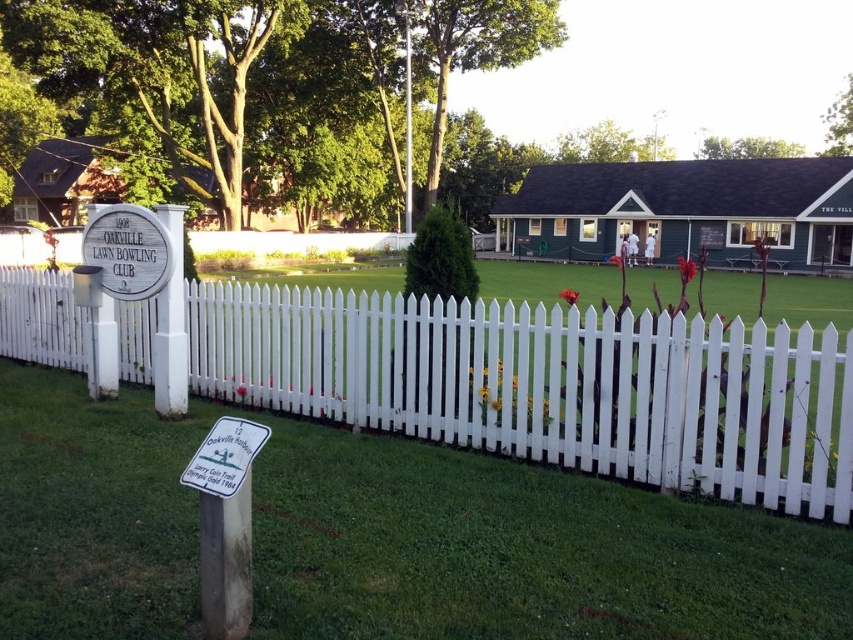
Question: Where is white picket fence at center located in relation to green mossy pole at center in the image?

Choices:
 (A) right
 (B) left

Answer: (A)

Question: Does green grass at center have a greater width compared to white plastic sign at lower center?

Choices:
 (A) yes
 (B) no

Answer: (A)

Question: Which object appears farthest from the camera in this image?

Choices:
 (A) green grass at center
 (B) white picket fence at center
 (C) silver metallic sign at center-left
 (D) green mossy pole at center

Answer: (D)

Question: Among these objects, which one is nearest to the camera?

Choices:
 (A) green grass at center
 (B) white plastic sign at lower center
 (C) silver metallic sign at center-left

Answer: (B)

Question: Which is nearer to the white plastic sign at lower center?

Choices:
 (A) green grass at center
 (B) white picket fence at center
 (C) green mossy pole at center
 (D) silver metallic sign at center-left

Answer: (A)

Question: Can you confirm if white plastic sign at lower center is thinner than green mossy pole at center?

Choices:
 (A) yes
 (B) no

Answer: (A)